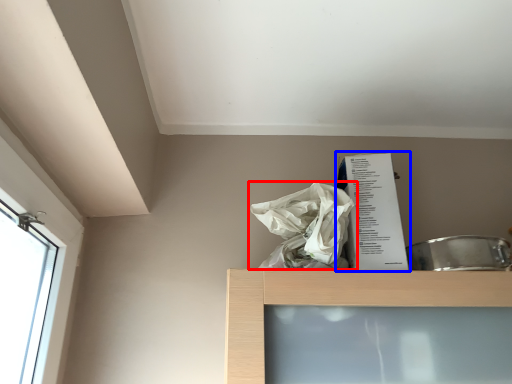
Question: Which point is closer to the camera, plastic bag (highlighted by a red box) or paperback book (highlighted by a blue box)?

Choices:
 (A) plastic bag
 (B) paperback book

Answer: (A)